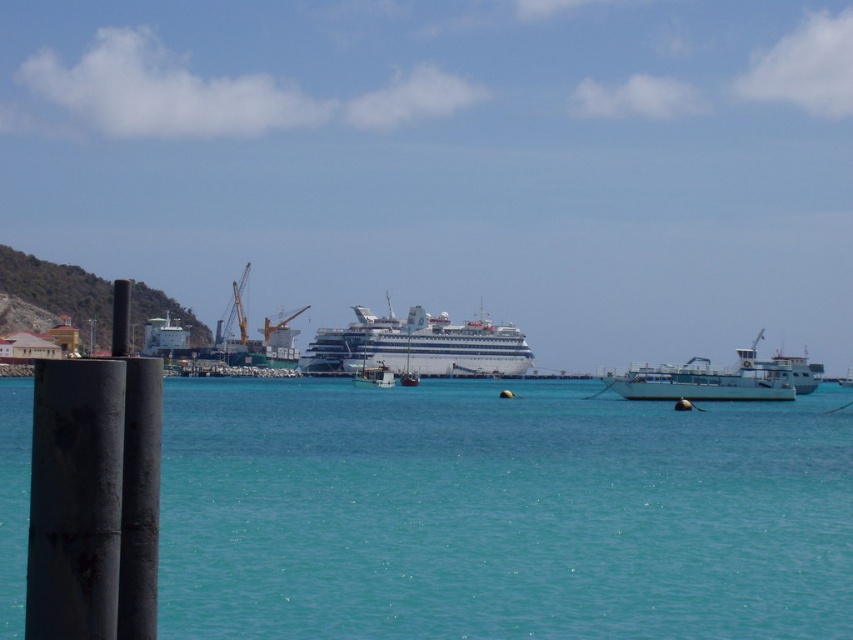
You are a photographer trying to capture the reflection of the white glossy cruise ship at center in the clear blue water at center. Based on the scene description, is the position of the cruise ship such that its reflection would be visible in the water?

The clear blue water at center is positioned under the white glossy cruise ship at center, so the reflection of the white glossy cruise ship at center would be visible in the clear blue water at center.

You are standing on a boat and looking at the clear blue water at center and the white glossy cruise ship at center. Which object appears taller from your viewpoint?

The white glossy cruise ship at center appears taller than the clear blue water at center because the clear blue water at center is shorter than the white glossy cruise ship at center.